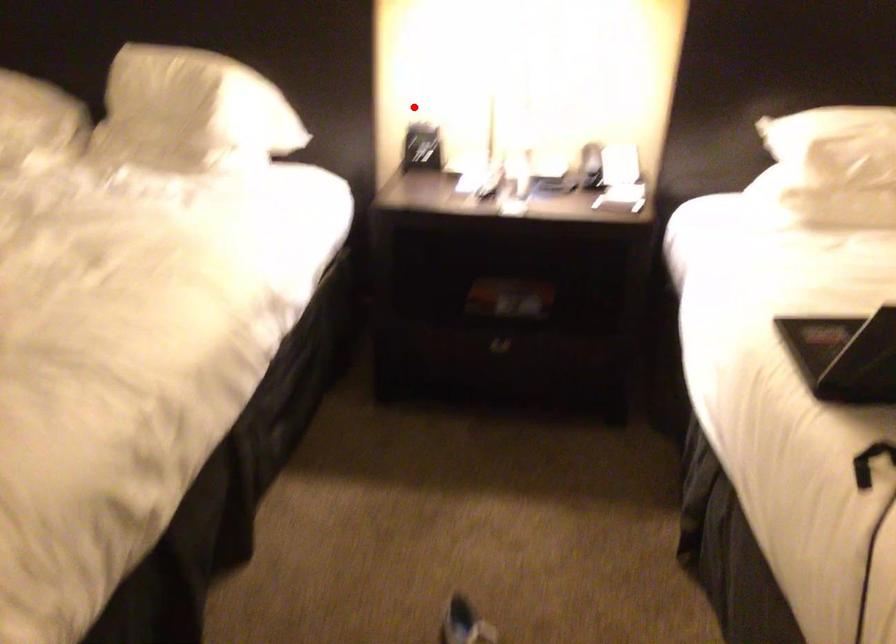
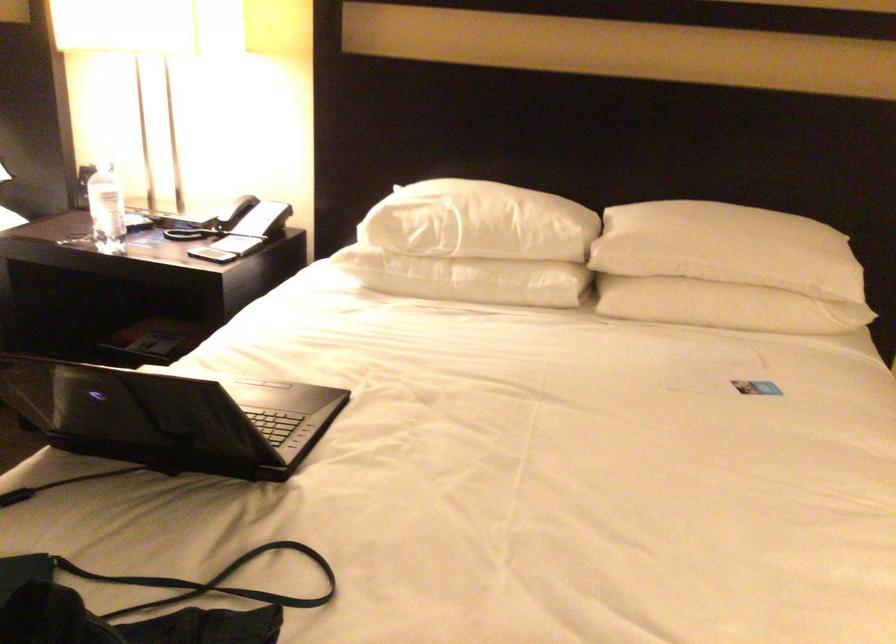
Question: I am providing you with two images of the same scene from different viewpoints. A red point is marked on the first image. Is the red point's position out of view in image 2?

Choices:
 (A) Yes
 (B) No

Answer: (B)